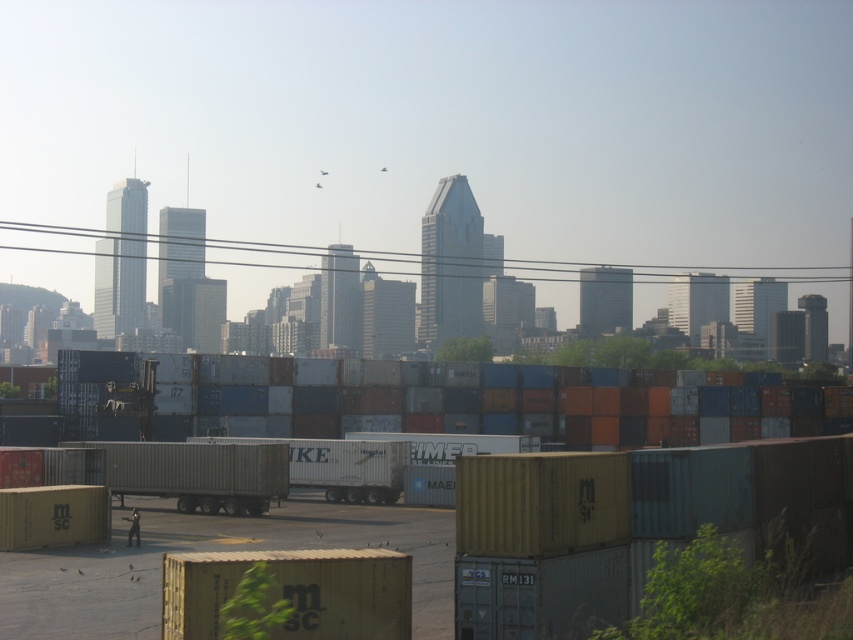
Between metallic silver trailer truck at center and white matte trailer truck at center, which one is positioned higher?

Positioned higher is metallic silver trailer truck at center.

Who is more forward, (112, 451) or (271, 440)?

Positioned in front is point (112, 451).

Does point (181, 454) come closer to viewer compared to point (289, 480)?

That is True.

Where is `metallic silver trailer truck at center`? This screenshot has height=640, width=853. metallic silver trailer truck at center is located at coordinates (196, 474).